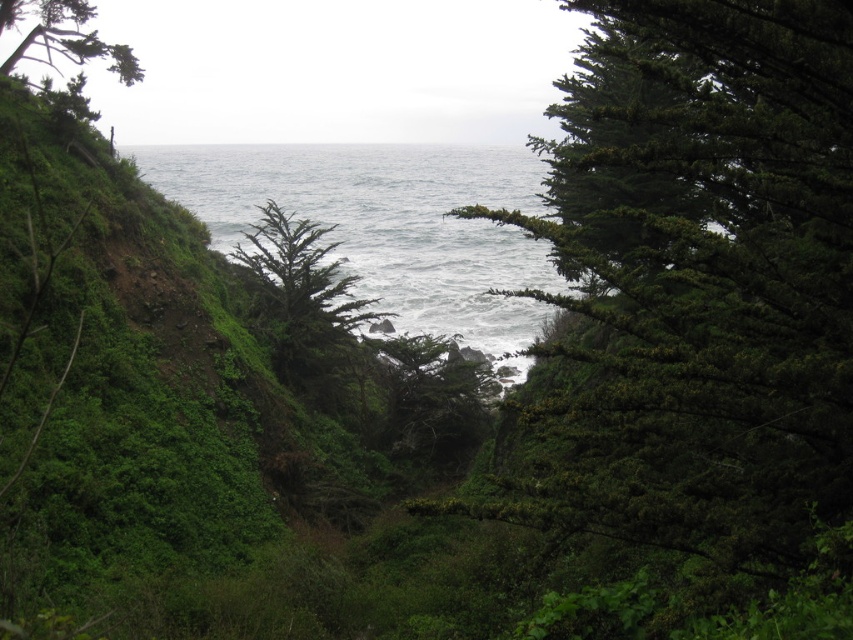
Is green needle-like foliage at center shorter than gray water at center?

Yes, green needle-like foliage at center is shorter than gray water at center.

Which is above, green needle-like foliage at center or gray water at center?

Positioned higher is gray water at center.

Image resolution: width=853 pixels, height=640 pixels. What are the coordinates of `green needle-like foliage at center` in the screenshot? It's located at (712, 300).

At what (x,y) coordinates should I click in order to perform the action: click on green needle-like foliage at center. Please return your answer as a coordinate pair (x, y). The image size is (853, 640). Looking at the image, I should click on (712, 300).

Which is more to the right, gray water at center or green textured tree at upper left?

gray water at center

Consider the image. Is gray water at center further to camera compared to green textured tree at upper left?

That is False.

Between point (256, 212) and point (80, 65), which one is positioned behind?

The point (80, 65) is behind.

Locate an element on the screen. gray water at center is located at coordinates (387, 224).

Can you confirm if green needle-like foliage at center is positioned to the left of green textured tree at upper left?

In fact, green needle-like foliage at center is to the right of green textured tree at upper left.

Does green needle-like foliage at center appear over green textured tree at upper left?

Actually, green needle-like foliage at center is below green textured tree at upper left.

The width and height of the screenshot is (853, 640). What do you see at coordinates (712, 300) in the screenshot?
I see `green needle-like foliage at center` at bounding box center [712, 300].

Identify the location of green needle-like foliage at center. (712, 300).